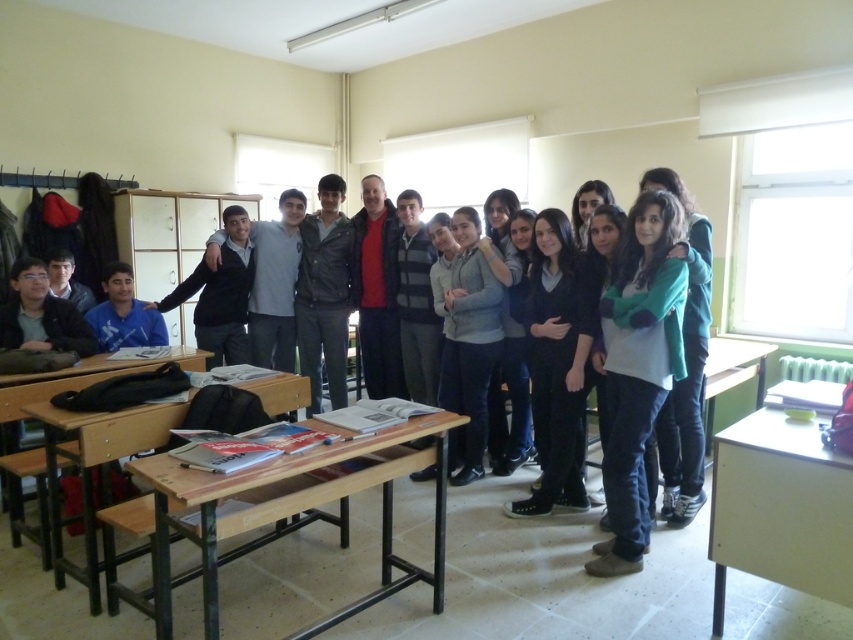
Question: Is wooden desk at lower left below wooden desk at right?

Choices:
 (A) yes
 (B) no

Answer: (A)

Question: Estimate the real-world distances between objects in this image. Which object is closer to the wooden desk at lower left?

Choices:
 (A) wooden table at center
 (B) green fleece sweater at center

Answer: (A)

Question: Which point appears farthest from the camera in this image?

Choices:
 (A) (637, 557)
 (B) (761, 392)
 (C) (434, 611)

Answer: (B)

Question: Does green fleece sweater at center come in front of wooden desk at right?

Choices:
 (A) no
 (B) yes

Answer: (B)

Question: Is wooden table at center to the right of light wood table at right from the viewer's perspective?

Choices:
 (A) yes
 (B) no

Answer: (B)

Question: Which object appears farthest from the camera in this image?

Choices:
 (A) wooden desk at lower left
 (B) light wood table at right

Answer: (A)